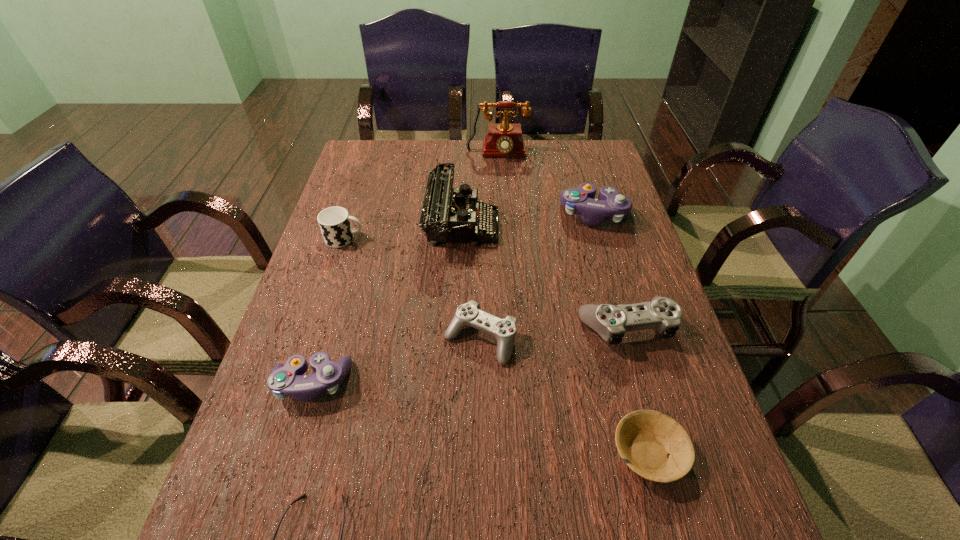
At what (x,y) coordinates should I click in order to perform the action: click on the shortest control. Please return your answer as a coordinate pair (x, y). Looking at the image, I should click on (468, 314).

You are a GUI agent. You are given a task and a screenshot of the screen. Output one action in this format:
    pyautogui.click(x=<x>, y=<y>)
    Task: Click on the bowl
    This screenshot has height=540, width=960.
    Given the screenshot: What is the action you would take?
    pyautogui.click(x=644, y=438)

Image resolution: width=960 pixels, height=540 pixels. Find the location of `free location located 0.360m on the dial of the farthest object`. free location located 0.360m on the dial of the farthest object is located at coordinates (501, 230).

Where is `vacant space located on the keyboard of the typewriter`? vacant space located on the keyboard of the typewriter is located at coordinates (590, 226).

Where is `free location located 0.300m on the front of the bigger purple control`? free location located 0.300m on the front of the bigger purple control is located at coordinates (624, 314).

You are a GUI agent. You are given a task and a screenshot of the screen. Output one action in this format:
    pyautogui.click(x=<x>, y=<y>)
    Task: Click on the vacant area situated 0.400m on the side of the cup with the handle
    
    Given the screenshot: What is the action you would take?
    pyautogui.click(x=504, y=239)

The height and width of the screenshot is (540, 960). I want to click on free region located on the back of the bigger white control, so click(x=612, y=279).

Find the location of a particular element. This screenshot has width=960, height=540. vacant region located on the front of the leftmost control is located at coordinates (273, 516).

Image resolution: width=960 pixels, height=540 pixels. What are the coordinates of `vacant space situated 0.210m on the front of the smaller white control` in the screenshot? It's located at (480, 464).

Where is `vacant space situated 0.250m on the left of the bowl`? vacant space situated 0.250m on the left of the bowl is located at coordinates (479, 453).